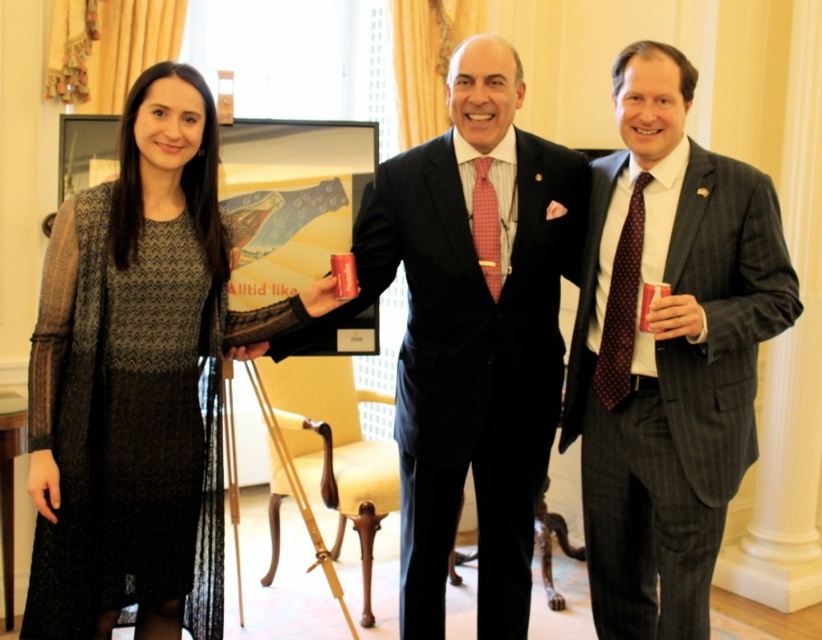
Can you confirm if matte black suit at center is thinner than polka dot silk tie at right?

No, matte black suit at center is not thinner than polka dot silk tie at right.

How far apart are matte black suit at center and polka dot silk tie at right?

A distance of 17.02 inches exists between matte black suit at center and polka dot silk tie at right.

In order to click on matte black suit at center in this screenshot , I will do `click(474, 337)`.

How distant is knitted wool dress at left from red woven tie at center?

knitted wool dress at left is 36.79 inches from red woven tie at center.

I want to click on knitted wool dress at left, so click(137, 380).

Describe the element at coordinates (137, 380) in the screenshot. I see `knitted wool dress at left` at that location.

This screenshot has height=640, width=822. What are the coordinates of `knitted wool dress at left` in the screenshot? It's located at (137, 380).

Is knitted wool dress at left above matte black suit at center?

Actually, knitted wool dress at left is below matte black suit at center.

Between knitted wool dress at left and matte black suit at center, which one appears on the left side from the viewer's perspective?

From the viewer's perspective, knitted wool dress at left appears more on the left side.

This screenshot has width=822, height=640. I want to click on knitted wool dress at left, so click(137, 380).